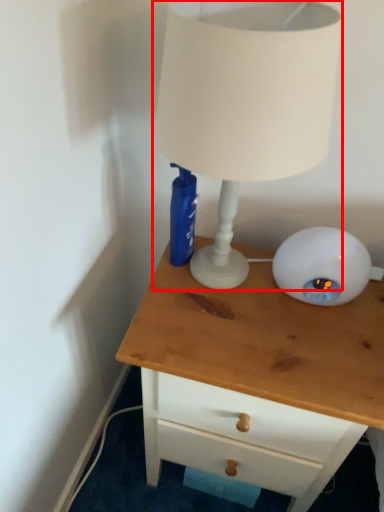
Question: Where is lamp (annotated by the red box) located in relation to chest of drawers in the image?

Choices:
 (A) right
 (B) left

Answer: (B)